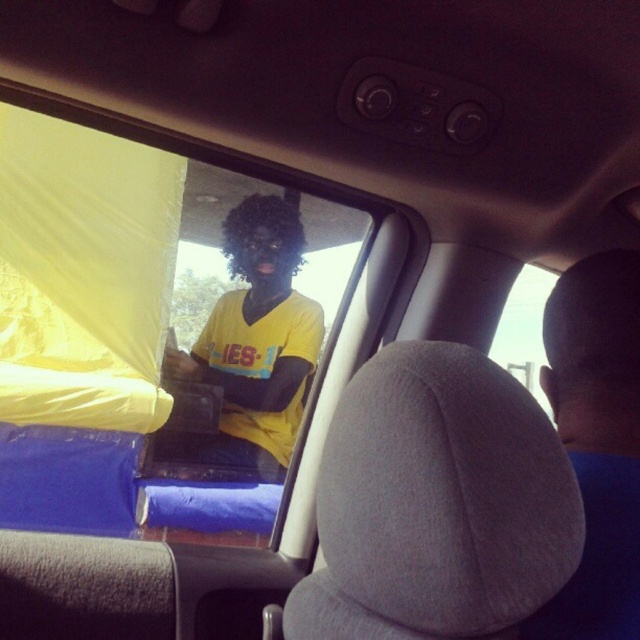
Is yellow matte shirt at center to the left of dark curly hair at center from the viewer's perspective?

Correct, you'll find yellow matte shirt at center to the left of dark curly hair at center.

Which is behind, point (228, 308) or point (273, 257)?

The point (273, 257) is more distant.

Locate an element on the screen. yellow matte shirt at center is located at coordinates (252, 346).

Does yellow fabric at left appear on the left side of yellow matte shirt at center?

Indeed, yellow fabric at left is positioned on the left side of yellow matte shirt at center.

Can you confirm if yellow fabric at left is positioned to the right of yellow matte shirt at center?

Incorrect, yellow fabric at left is not on the right side of yellow matte shirt at center.

At what (x,y) coordinates should I click in order to perform the action: click on yellow fabric at left. Please return your answer as a coordinate pair (x, y). The height and width of the screenshot is (640, 640). Looking at the image, I should click on (147, 337).

Describe the element at coordinates (147, 337) in the screenshot. I see `yellow fabric at left` at that location.

Is point (195, 282) positioned after point (259, 195)?

No.

This screenshot has width=640, height=640. Identify the location of yellow fabric at left. (147, 337).